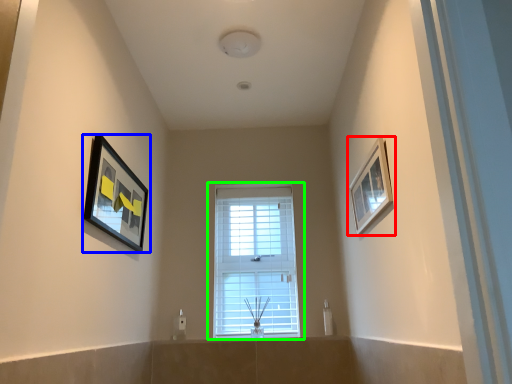
Question: Based on their relative distances, which object is farther from picture frame (highlighted by a red box)? Choose from picture frame (highlighted by a blue box) and window (highlighted by a green box).

Choices:
 (A) picture frame
 (B) window

Answer: (A)